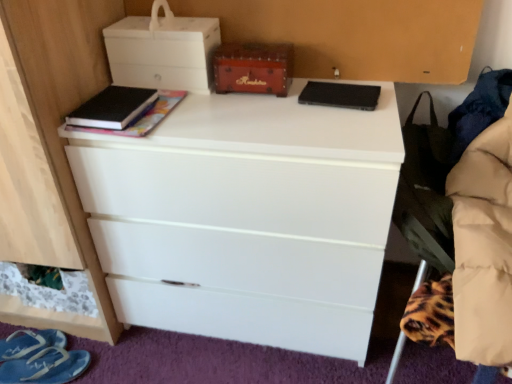
Where is `free point above white matte chest of drawers at center (from a real-world perspective)`? The width and height of the screenshot is (512, 384). free point above white matte chest of drawers at center (from a real-world perspective) is located at coordinates (258, 107).